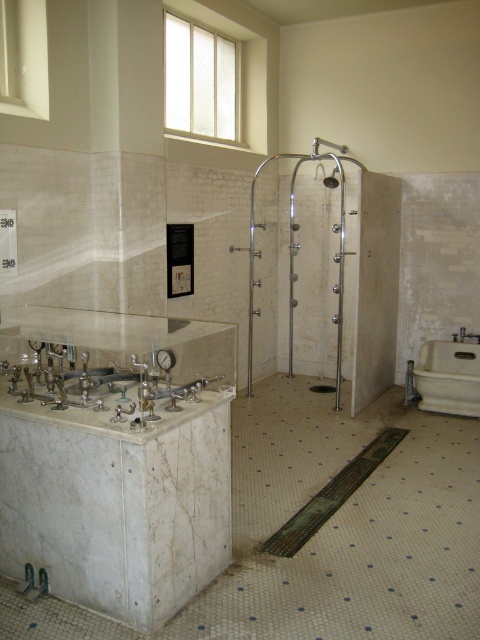
Question: From the image, what is the correct spatial relationship of white marble sink at lower left in relation to satin nickel shower head at upper center?

Choices:
 (A) left
 (B) right

Answer: (A)

Question: Which object is farther from the camera taking this photo?

Choices:
 (A) white marble sink at lower left
 (B) white porcelain bathtub at lower right
 (C) satin nickel shower head at upper center

Answer: (C)

Question: Does white porcelain bathtub at lower right appear over satin nickel shower head at upper center?

Choices:
 (A) no
 (B) yes

Answer: (A)

Question: Is white marble sink at lower left in front of satin nickel shower head at upper center?

Choices:
 (A) no
 (B) yes

Answer: (B)

Question: Which object is farther from the camera taking this photo?

Choices:
 (A) satin nickel shower head at upper center
 (B) white marble sink at lower left

Answer: (A)

Question: Which is nearer to the satin nickel shower head at upper center?

Choices:
 (A) white porcelain bathtub at lower right
 (B) white marble sink at lower left

Answer: (A)